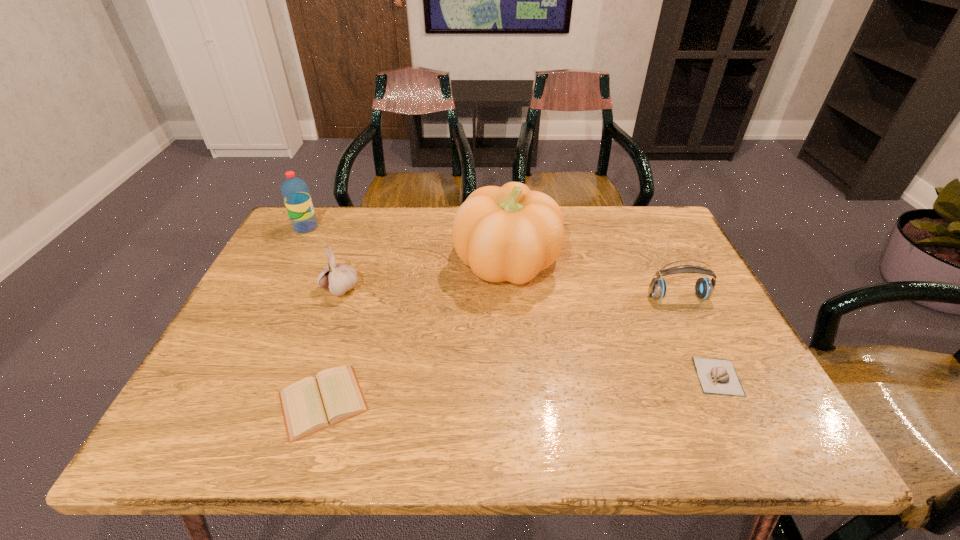
Locate an element on the screen. The image size is (960, 540). headset situated at the right edge is located at coordinates (704, 287).

Where is `garlic that is positioned at the right edge`? garlic that is positioned at the right edge is located at coordinates (716, 376).

This screenshot has width=960, height=540. In order to click on object located at the far left corner in this screenshot , I will do `click(295, 192)`.

Locate an element on the screen. blank space at the far edge of the desktop is located at coordinates (424, 233).

This screenshot has height=540, width=960. What are the coordinates of `vacant area at the near edge` in the screenshot? It's located at (667, 415).

Image resolution: width=960 pixels, height=540 pixels. Identify the location of free location at the left edge of the desktop. (229, 388).

In the image, there is a desktop. In order to click on free space at the right edge in this screenshot , I will do `click(706, 332)`.

Where is `vacant space at the far left corner of the desktop`? This screenshot has width=960, height=540. vacant space at the far left corner of the desktop is located at coordinates (287, 228).

The height and width of the screenshot is (540, 960). In the image, there is a desktop. In order to click on free space at the near left corner in this screenshot , I will do coord(169,448).

Locate an element on the screen. free spot at the far right corner of the desktop is located at coordinates (686, 253).